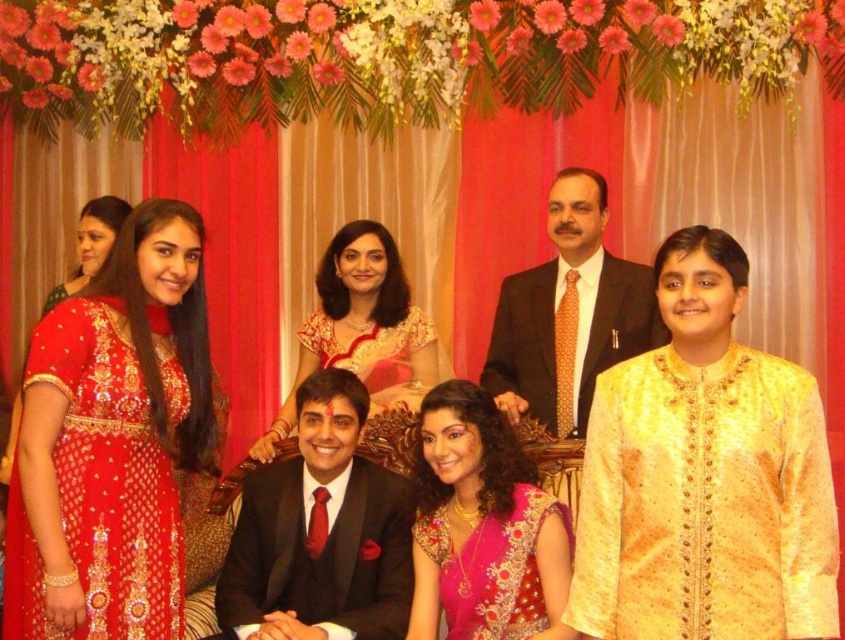
Question: Among these objects, which one is farthest from the camera?

Choices:
 (A) matte gold saree at center
 (B) matte black suit at center
 (C) shiny black suit at center
 (D) gold embroidered kurta at right

Answer: (A)

Question: Is pink embroidered saree at center thinner than matte gold kurta at center?

Choices:
 (A) yes
 (B) no

Answer: (A)

Question: Which object is positioned farthest from the matte gold kurta at center?

Choices:
 (A) shiny black suit at center
 (B) matte red dress at upper left

Answer: (B)

Question: Is gold embroidered kurta at right thinner than matte gold kurta at center?

Choices:
 (A) yes
 (B) no

Answer: (A)

Question: Is the position of gold embroidered kurta at right less distant than that of matte gold kurta at center?

Choices:
 (A) no
 (B) yes

Answer: (B)

Question: Which point is farther to the camera?

Choices:
 (A) matte black suit at center
 (B) matte gold saree at center
 (C) pink embroidered saree at center
 (D) matte gold kurta at center

Answer: (B)